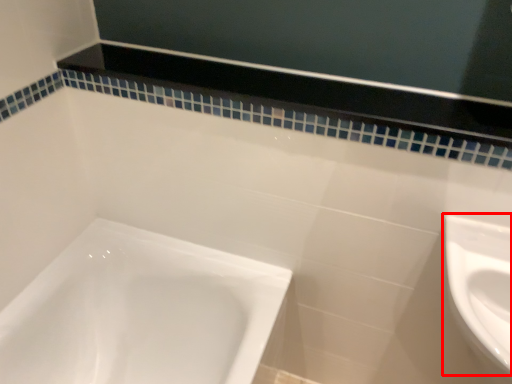
Question: Where is sink (annotated by the red box) located in relation to balustrade in the image?

Choices:
 (A) left
 (B) right

Answer: (B)